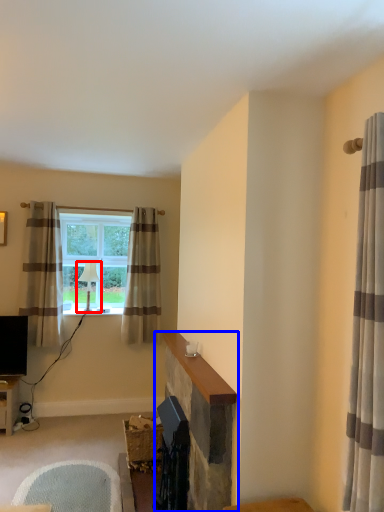
Question: Which object appears farthest to the camera in this image, lamp (highlighted by a red box) or fireplace (highlighted by a blue box)?

Choices:
 (A) lamp
 (B) fireplace

Answer: (A)